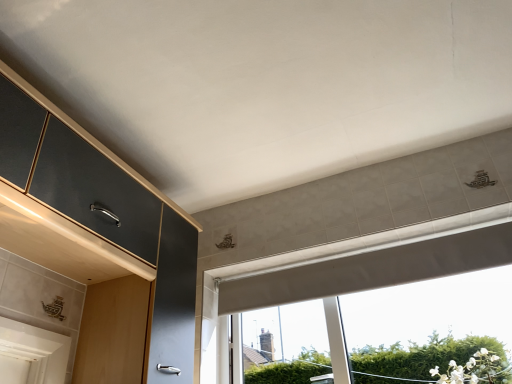
Question: From the image's perspective, is white matte window at center beneath matte black cabinet at left?

Choices:
 (A) no
 (B) yes

Answer: (B)

Question: Is the position of white matte window at center more distant than that of matte black cabinet at left?

Choices:
 (A) no
 (B) yes

Answer: (B)

Question: Considering the relative sizes of white matte window at center and matte black cabinet at left in the image provided, is white matte window at center shorter than matte black cabinet at left?

Choices:
 (A) no
 (B) yes

Answer: (B)

Question: Is white matte window at center to the left of matte black cabinet at left from the viewer's perspective?

Choices:
 (A) no
 (B) yes

Answer: (A)

Question: From the image's perspective, is white matte window at center located above matte black cabinet at left?

Choices:
 (A) no
 (B) yes

Answer: (A)

Question: Is white matte window at center completely or partially outside of matte black cabinet at left?

Choices:
 (A) yes
 (B) no

Answer: (A)

Question: Is the position of matte black cabinet at left less distant than that of white matte window at center?

Choices:
 (A) yes
 (B) no

Answer: (A)

Question: Considering the relative sizes of matte black cabinet at left and white matte window at center in the image provided, is matte black cabinet at left shorter than white matte window at center?

Choices:
 (A) yes
 (B) no

Answer: (B)

Question: Does matte black cabinet at left have a greater height compared to white matte window at center?

Choices:
 (A) yes
 (B) no

Answer: (A)

Question: Considering the relative sizes of matte black cabinet at left and white matte window at center in the image provided, is matte black cabinet at left wider than white matte window at center?

Choices:
 (A) yes
 (B) no

Answer: (A)

Question: Is the position of matte black cabinet at left more distant than that of white matte window at center?

Choices:
 (A) no
 (B) yes

Answer: (A)

Question: Can you confirm if matte black cabinet at left is positioned to the right of white matte window at center?

Choices:
 (A) yes
 (B) no

Answer: (B)

Question: In the image, is white matte window at center positioned in front of or behind matte black cabinet at left?

Choices:
 (A) front
 (B) behind

Answer: (B)